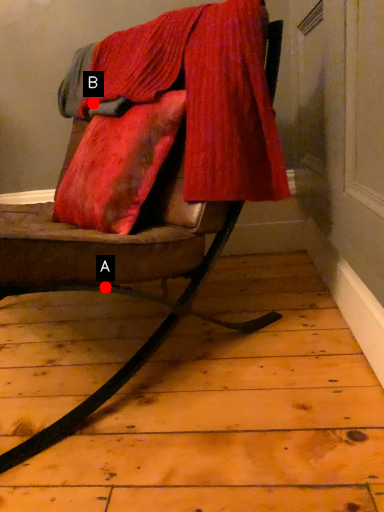
Question: Two points are circled on the image, labeled by A and B beside each circle. Which point is closer to the camera?

Choices:
 (A) A is closer
 (B) B is closer

Answer: (A)